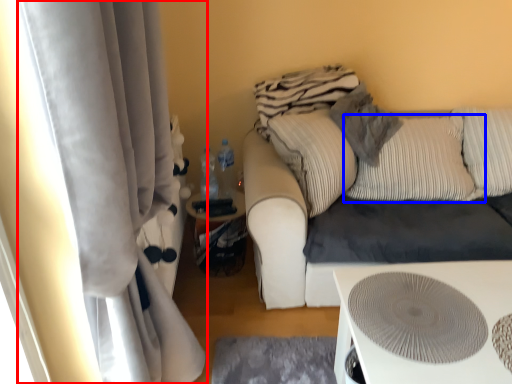
Question: Among these objects, which one is nearest to the camera, curtain (highlighted by a red box) or pillow (highlighted by a blue box)?

Choices:
 (A) curtain
 (B) pillow

Answer: (A)